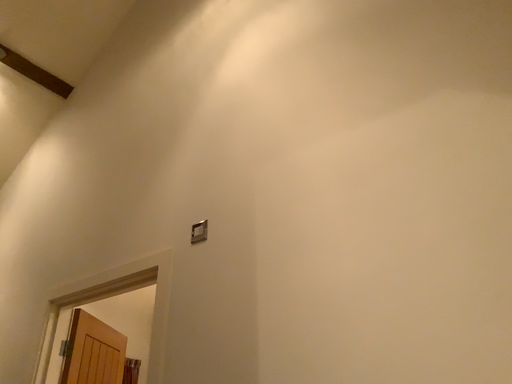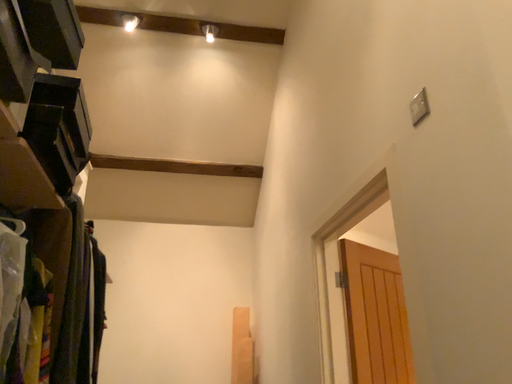
Question: Which way did the camera rotate in the video?

Choices:
 (A) rotated right
 (B) rotated left

Answer: (B)